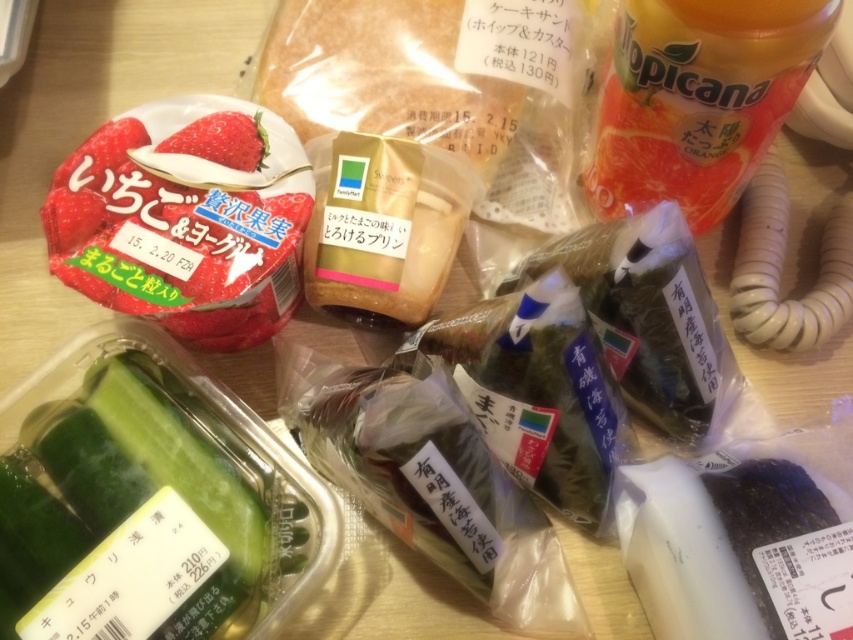
How far apart are green matte cucumber at lower left and matte plastic strawberry at center left?

A distance of 7.86 inches exists between green matte cucumber at lower left and matte plastic strawberry at center left.

Is point (163, 637) in front of point (210, 163)?

Yes.

At what (x,y) coordinates should I click in order to perform the action: click on green matte cucumber at lower left. Please return your answer as a coordinate pair (x, y). The height and width of the screenshot is (640, 853). Looking at the image, I should click on (131, 516).

In the scene shown: Measure the distance between matte plastic strawberry at center left and matte white strawberry at upper center.

→ matte plastic strawberry at center left is 9.80 centimeters from matte white strawberry at upper center.

Can you confirm if matte plastic strawberry at center left is bigger than matte white strawberry at upper center?

Yes.

What are the coordinates of `matte plastic strawberry at center left` in the screenshot? It's located at (184, 218).

Who is lower down, green matte cucumber at lower left or orange plastic bottle at upper right?

green matte cucumber at lower left is below.

In the scene shown: Between green matte cucumber at lower left and orange plastic bottle at upper right, which one appears on the left side from the viewer's perspective?

green matte cucumber at lower left

Who is more distant from viewer, (155, 413) or (619, 184)?

The point (619, 184) is more distant.

This screenshot has width=853, height=640. Find the location of `green matte cucumber at lower left`. green matte cucumber at lower left is located at coordinates [131, 516].